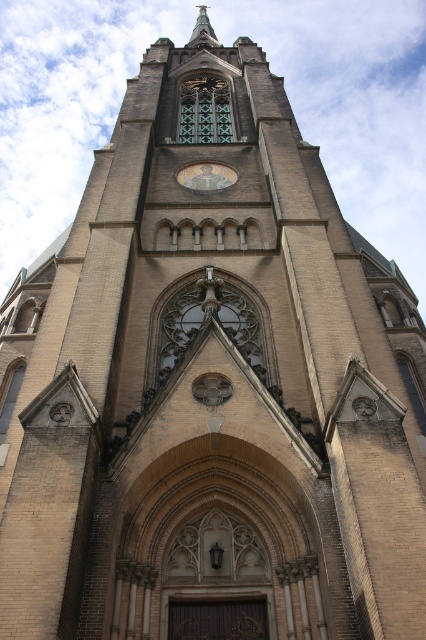
Question: Can you confirm if gold metallic clock at center is positioned to the left of polished gold spire at upper center?

Choices:
 (A) no
 (B) yes

Answer: (A)

Question: Among these points, which one is nearest to the camera?

Choices:
 (A) (210, 163)
 (B) (213, 42)

Answer: (A)

Question: Observing the image, what is the correct spatial positioning of gold metallic clock at center in reference to polished gold spire at upper center?

Choices:
 (A) below
 (B) above

Answer: (A)

Question: Does gold metallic clock at center appear over polished gold spire at upper center?

Choices:
 (A) no
 (B) yes

Answer: (A)

Question: Which of the following is the farthest from the observer?

Choices:
 (A) gold metallic clock at center
 (B) polished gold spire at upper center

Answer: (B)

Question: Which point is farther to the camera?

Choices:
 (A) gold metallic clock at center
 (B) polished gold spire at upper center

Answer: (B)